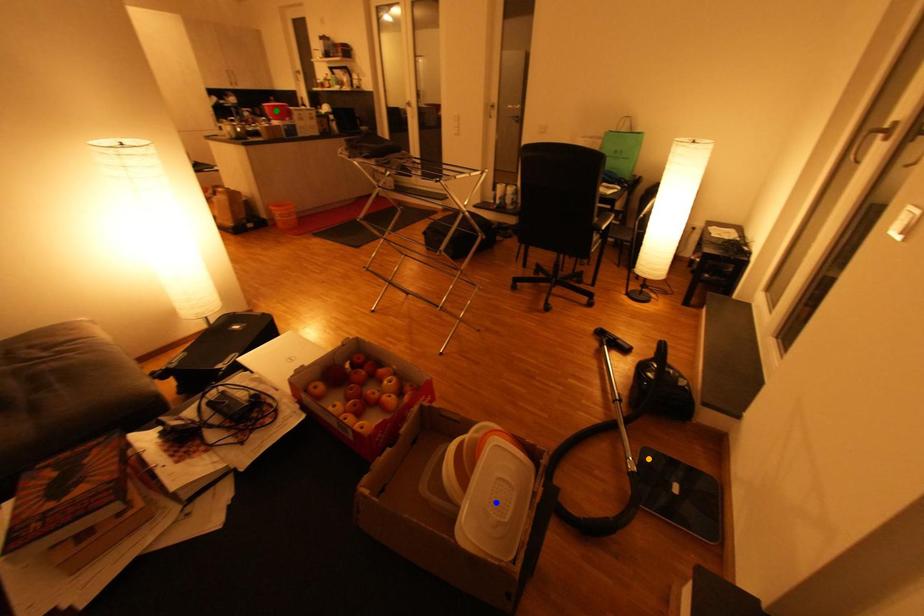
Order these from nearest to farthest:
1. orange point
2. blue point
3. green point

1. blue point
2. orange point
3. green point